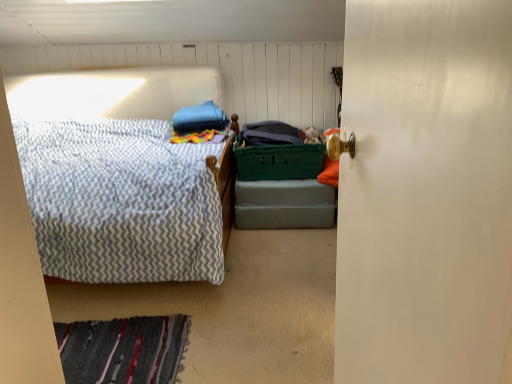
The height and width of the screenshot is (384, 512). I want to click on striped wool rug at lower left, so click(x=123, y=350).

In the scene shown: What is the approximate width of striped wool rug at lower left?

25.50 inches.

The image size is (512, 384). I want to click on green plastic laundry basket at center, so click(x=279, y=162).

Based on the photo, in order to face white glossy door at right, should I rotate leftwards or rightwards?

Turn right by 14.493 degrees to look at white glossy door at right.

At what (x,y) coordinates should I click in order to perform the action: click on green plastic crate at center. Please return your answer as a coordinate pair (x, y). This screenshot has width=512, height=384. Looking at the image, I should click on (283, 204).

From the image's perspective, who appears lower, green plastic laundry basket at center or striped wool rug at lower left?

striped wool rug at lower left appears lower in the image.

Would you say green plastic laundry basket at center is inside or outside striped wool rug at lower left?

green plastic laundry basket at center cannot be found inside striped wool rug at lower left.

From a real-world perspective, is green plastic laundry basket at center located higher than striped wool rug at lower left?

Yes.

From the image's perspective, who appears lower, green plastic crate at center or striped wool rug at lower left?

From the image's view, striped wool rug at lower left is below.

Does green plastic crate at center touch striped wool rug at lower left?

No.

Is the depth of green plastic crate at center greater than that of striped wool rug at lower left?

Yes, green plastic crate at center is behind striped wool rug at lower left.

Which is more to the left, green plastic crate at center or striped wool rug at lower left?

striped wool rug at lower left is more to the left.

Is white glossy door at right bigger than green plastic laundry basket at center?

No.

Is white glossy door at right facing away from green plastic laundry basket at center?

No.

Is point (345, 72) closer to camera compared to point (241, 154)?

Yes.

Is white glossy door at right to the left or to the right of green plastic laundry basket at center in the image?

Based on their positions, white glossy door at right is located to the right of green plastic laundry basket at center.

Is white glossy door at right wider or thinner than striped wool rug at lower left?

white glossy door at right is thinner than striped wool rug at lower left.

Who is taller, white glossy door at right or striped wool rug at lower left?

white glossy door at right is taller.

Consider the image. Considering the positions of objects white glossy door at right and striped wool rug at lower left in the image provided, who is behind, white glossy door at right or striped wool rug at lower left?

striped wool rug at lower left is further from the camera.

Is white glossy door at right facing away from striped wool rug at lower left?

white glossy door at right does not have its back to striped wool rug at lower left.

Considering the relative positions of striped wool rug at lower left and white glossy door at right in the image provided, is striped wool rug at lower left to the left or to the right of white glossy door at right?

striped wool rug at lower left is to the left of white glossy door at right.

Is striped wool rug at lower left taller than white glossy door at right?

No.

How many degrees apart are the facing directions of striped wool rug at lower left and white glossy door at right?

179 degrees separate the facing orientations of striped wool rug at lower left and white glossy door at right.

Which is closer to the camera, (83, 381) or (456, 137)?

Point (83, 381).

Is green plastic laundry basket at center not near green plastic crate at center?

green plastic laundry basket at center is near green plastic crate at center, not far away.

Does green plastic laundry basket at center come in front of green plastic crate at center?

That is True.

In the scene shown: Does green plastic laundry basket at center have a smaller size compared to green plastic crate at center?

Yes, green plastic laundry basket at center is smaller than green plastic crate at center.

From the image's perspective, which is below, striped wool rug at lower left or green plastic crate at center?

striped wool rug at lower left is shown below in the image.

Can you tell me how much striped wool rug at lower left and green plastic crate at center differ in facing direction?

The facing directions of striped wool rug at lower left and green plastic crate at center are 95.8 degrees apart.

Between striped wool rug at lower left and green plastic crate at center, which one has smaller width?

green plastic crate at center.

Is green plastic crate at center at the back of striped wool rug at lower left?

No, striped wool rug at lower left's orientation is not away from green plastic crate at center.

Locate an element on the screen. laundry basket that appears on the right of striped wool rug at lower left is located at coordinates (279, 162).

Locate an element on the screen. The image size is (512, 384). mat on the left of green plastic crate at center is located at coordinates (123, 350).

Looking at the image, which one is located closer to green plastic crate at center, white glossy door at right or striped wool rug at lower left?

striped wool rug at lower left lies closer to green plastic crate at center than the other object.

Estimate the real-world distances between objects in this image. Which object is closer to green plastic laundry basket at center, green plastic crate at center or white glossy door at right?

green plastic crate at center is positioned closer to the anchor green plastic laundry basket at center.

When comparing their distances from white glossy door at right, does green plastic laundry basket at center or green plastic crate at center seem further?

Based on the image, green plastic laundry basket at center appears to be further to white glossy door at right.

From the image, which object appears to be farther from striped wool rug at lower left, white glossy door at right or green plastic crate at center?

white glossy door at right is further to striped wool rug at lower left.

Based on the photo, from the image, which object appears to be nearer to green plastic laundry basket at center, striped wool rug at lower left or green plastic crate at center?

green plastic crate at center.

When comparing their distances from white glossy door at right, does striped wool rug at lower left or green plastic crate at center seem further?

green plastic crate at center.

When comparing their distances from green plastic crate at center, does striped wool rug at lower left or white glossy door at right seem further?

white glossy door at right is further to green plastic crate at center.

From the picture: Which object lies further to the anchor point striped wool rug at lower left, green plastic laundry basket at center or green plastic crate at center?

green plastic laundry basket at center.

You are a GUI agent. You are given a task and a screenshot of the screen. Output one action in this format:
    pyautogui.click(x=<x>, y=<y>)
    Task: Click on the laundry basket between striped wool rug at lower left and green plastic crate at center in the front-back direction
    The image size is (512, 384).
    Given the screenshot: What is the action you would take?
    pyautogui.click(x=279, y=162)

Where is `mat between white glossy door at right and green plastic laundry basket at center from front to back`? The width and height of the screenshot is (512, 384). mat between white glossy door at right and green plastic laundry basket at center from front to back is located at coordinates (123, 350).

This screenshot has width=512, height=384. Find the location of `mat between white glossy door at right and green plastic crate at center from front to back`. mat between white glossy door at right and green plastic crate at center from front to back is located at coordinates click(123, 350).

Identify the location of laundry basket between white glossy door at right and green plastic crate at center from front to back. The image size is (512, 384). (279, 162).